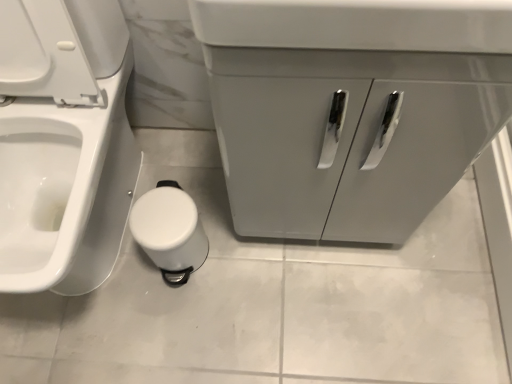
From the picture: In order to face white glossy toilet at lower left, should I rotate leftwards or rightwards?

Turn left by 28.470 degrees to look at white glossy toilet at lower left.

Describe the element at coordinates (170, 231) in the screenshot. I see `white plastic toilet paper at lower center` at that location.

Identify the location of white glossy toilet at lower left. This screenshot has width=512, height=384. (63, 143).

Considering their positions, is matte gray cabinet at center located in front of or behind white plastic toilet paper at lower center?

matte gray cabinet at center is in front of white plastic toilet paper at lower center.

Does point (486, 11) lie behind point (189, 249)?

No, it is in front of (189, 249).

Considering the relative sizes of matte gray cabinet at center and white plastic toilet paper at lower center in the image provided, is matte gray cabinet at center smaller than white plastic toilet paper at lower center?

No, matte gray cabinet at center is not smaller than white plastic toilet paper at lower center.

Between matte gray cabinet at center and white plastic toilet paper at lower center, which one appears on the right side from the viewer's perspective?

matte gray cabinet at center.

Based on the photo, is white plastic toilet paper at lower center completely or partially outside of matte gray cabinet at center?

That's correct, white plastic toilet paper at lower center is outside of matte gray cabinet at center.

Is white plastic toilet paper at lower center not near matte gray cabinet at center?

That's not correct — white plastic toilet paper at lower center is a little close to matte gray cabinet at center.

Is white plastic toilet paper at lower center facing away from matte gray cabinet at center?

No, white plastic toilet paper at lower center's orientation is not away from matte gray cabinet at center.

Relative to matte gray cabinet at center, is white plastic toilet paper at lower center in front or behind?

white plastic toilet paper at lower center is positioned farther from the viewer than matte gray cabinet at center.

Which object is thinner, matte gray cabinet at center or white glossy toilet at lower left?

With smaller width is matte gray cabinet at center.

Between matte gray cabinet at center and white glossy toilet at lower left, which one appears on the left side from the viewer's perspective?

Positioned to the left is white glossy toilet at lower left.

Considering the relative sizes of matte gray cabinet at center and white glossy toilet at lower left in the image provided, is matte gray cabinet at center taller than white glossy toilet at lower left?

No.

From the image's perspective, which one is positioned lower, matte gray cabinet at center or white glossy toilet at lower left?

white glossy toilet at lower left is shown below in the image.

Based on the photo, does white glossy toilet at lower left have a larger size compared to white plastic toilet paper at lower center?

Indeed, white glossy toilet at lower left has a larger size compared to white plastic toilet paper at lower center.

You are a GUI agent. You are given a task and a screenshot of the screen. Output one action in this format:
    pyautogui.click(x=<x>, y=<y>)
    Task: Click on the toilet lying on the left of white plastic toilet paper at lower center
    Image resolution: width=512 pixels, height=384 pixels.
    Given the screenshot: What is the action you would take?
    pyautogui.click(x=63, y=143)

Which is behind, point (78, 101) or point (164, 194)?

The point (164, 194) is behind.

Which object is positioned more to the right, white glossy toilet at lower left or white plastic toilet paper at lower center?

white plastic toilet paper at lower center is more to the right.

Looking at this image, who is taller, white glossy toilet at lower left or matte gray cabinet at center?

white glossy toilet at lower left is taller.

You are a GUI agent. You are given a task and a screenshot of the screen. Output one action in this format:
    pyautogui.click(x=<x>, y=<y>)
    Task: Click on the toilet below the matte gray cabinet at center (from the image's perspective)
    This screenshot has width=512, height=384.
    Given the screenshot: What is the action you would take?
    pyautogui.click(x=63, y=143)

Which object is positioned more to the right, white glossy toilet at lower left or matte gray cabinet at center?

matte gray cabinet at center is more to the right.

Which object is wider, white plastic toilet paper at lower center or white glossy toilet at lower left?

Wider between the two is white glossy toilet at lower left.

Is point (172, 267) closer to camera compared to point (15, 238)?

No, (172, 267) is further to viewer.

Looking at this image, is white glossy toilet at lower left completely or partially inside white plastic toilet paper at lower center?

No.

Locate an element on the screen. The width and height of the screenshot is (512, 384). bathroom cabinet above the white plastic toilet paper at lower center (from the image's perspective) is located at coordinates (351, 108).

Identify the location of bathroom cabinet located on the right of white plastic toilet paper at lower center. (351, 108).

When comparing their distances from matte gray cabinet at center, does white glossy toilet at lower left or white plastic toilet paper at lower center seem closer?

The object closer to matte gray cabinet at center is white plastic toilet paper at lower center.

When comparing their distances from white glossy toilet at lower left, does matte gray cabinet at center or white plastic toilet paper at lower center seem further?

matte gray cabinet at center is further to white glossy toilet at lower left.

Looking at the image, which one is located further to white plastic toilet paper at lower center, matte gray cabinet at center or white glossy toilet at lower left?

matte gray cabinet at center.

Based on their spatial positions, is white plastic toilet paper at lower center or matte gray cabinet at center further from white glossy toilet at lower left?

The object further to white glossy toilet at lower left is matte gray cabinet at center.

From the image, which object appears to be farther from white plastic toilet paper at lower center, white glossy toilet at lower left or matte gray cabinet at center?

matte gray cabinet at center lies further to white plastic toilet paper at lower center than the other object.

Based on their spatial positions, is white plastic toilet paper at lower center or white glossy toilet at lower left further from matte gray cabinet at center?

white glossy toilet at lower left lies further to matte gray cabinet at center than the other object.

At what (x,y) coordinates should I click in order to perform the action: click on toilet paper situated between white glossy toilet at lower left and matte gray cabinet at center from left to right. Please return your answer as a coordinate pair (x, y). Looking at the image, I should click on click(170, 231).